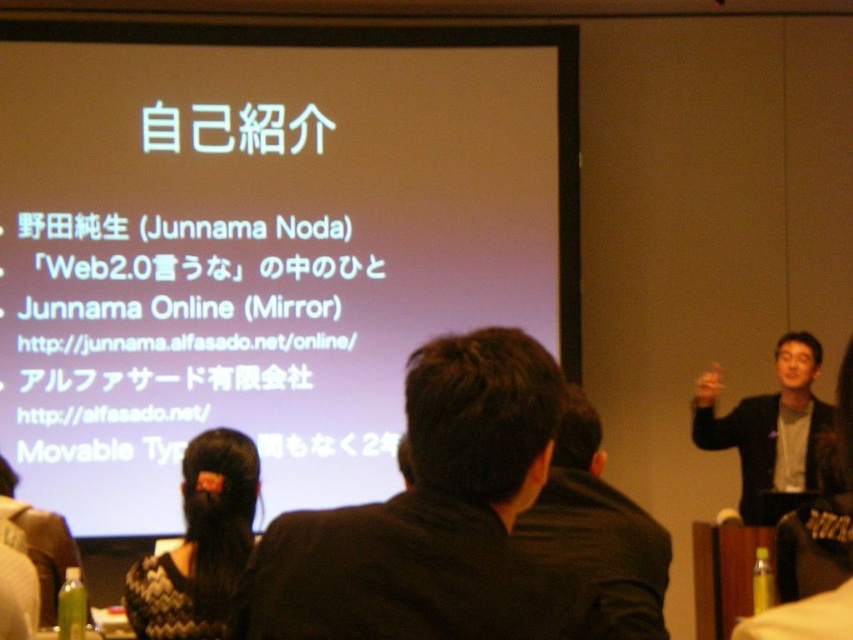
Question: Among these points, which one is nearest to the camera?

Choices:
 (A) (751, 426)
 (B) (178, 410)
 (C) (640, 552)

Answer: (C)

Question: Which point appears closest to the camera in this image?

Choices:
 (A) (775, 483)
 (B) (395, 253)
 (C) (215, 540)
 (D) (270, 564)

Answer: (D)

Question: Can you confirm if dark brown suit at center is positioned to the right of black suit at right?

Choices:
 (A) yes
 (B) no

Answer: (B)

Question: Is dark brown suit at center bigger than black suit at center?

Choices:
 (A) yes
 (B) no

Answer: (B)

Question: Does dark brown suit at center appear on the left side of black suit at right?

Choices:
 (A) no
 (B) yes

Answer: (B)

Question: Among these objects, which one is farthest from the camera?

Choices:
 (A) black suit at right
 (B) white matte projection screen at upper center

Answer: (B)